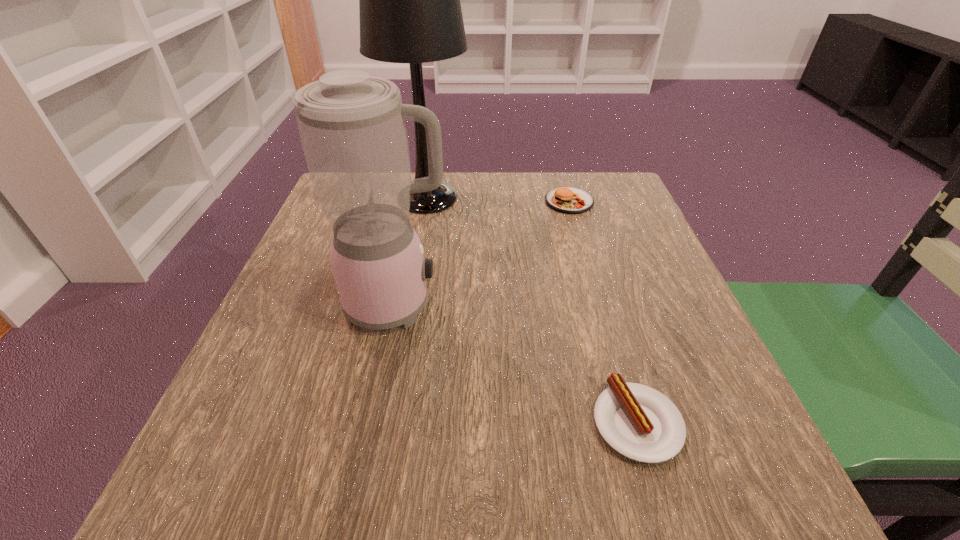
I want to click on table lamp, so click(410, 12).

This screenshot has width=960, height=540. I want to click on the second nearest object, so click(x=352, y=127).

Find the location of a particular element. The image size is (960, 540). food processor is located at coordinates (352, 127).

Identify the location of the second shortest object. (570, 200).

Locate an element on the screen. Image resolution: width=960 pixels, height=540 pixels. the shortest object is located at coordinates (639, 422).

The image size is (960, 540). Find the location of `the nearest object`. the nearest object is located at coordinates (639, 422).

Where is `free location located on the right of the table lamp`? free location located on the right of the table lamp is located at coordinates (555, 198).

Locate an element on the screen. free region located on the base of the food processor near the control knob is located at coordinates (613, 305).

Where is `vacant area situated 0.180m on the front of the second shortest object`? Image resolution: width=960 pixels, height=540 pixels. vacant area situated 0.180m on the front of the second shortest object is located at coordinates (587, 262).

The width and height of the screenshot is (960, 540). I want to click on vacant space situated on the left of the sausage, so click(x=426, y=422).